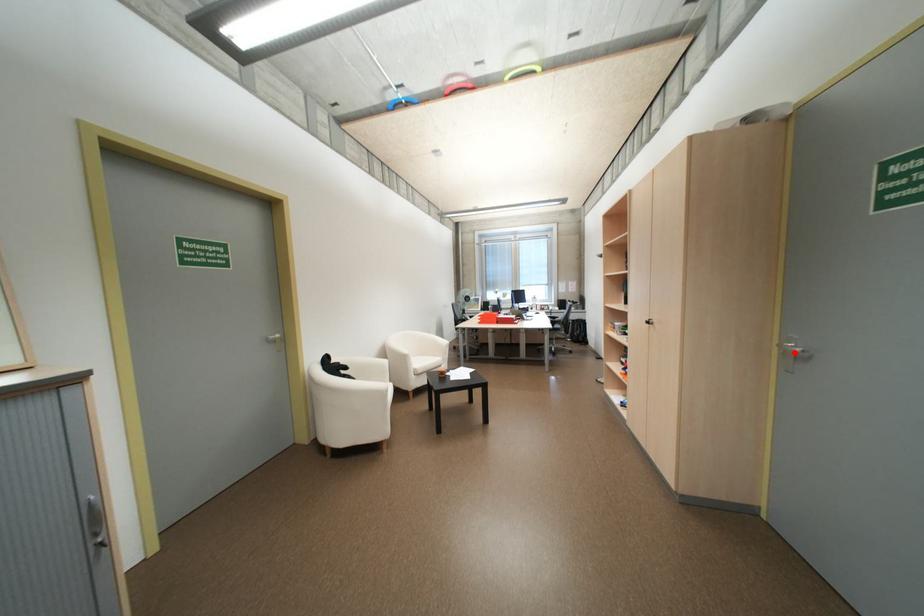
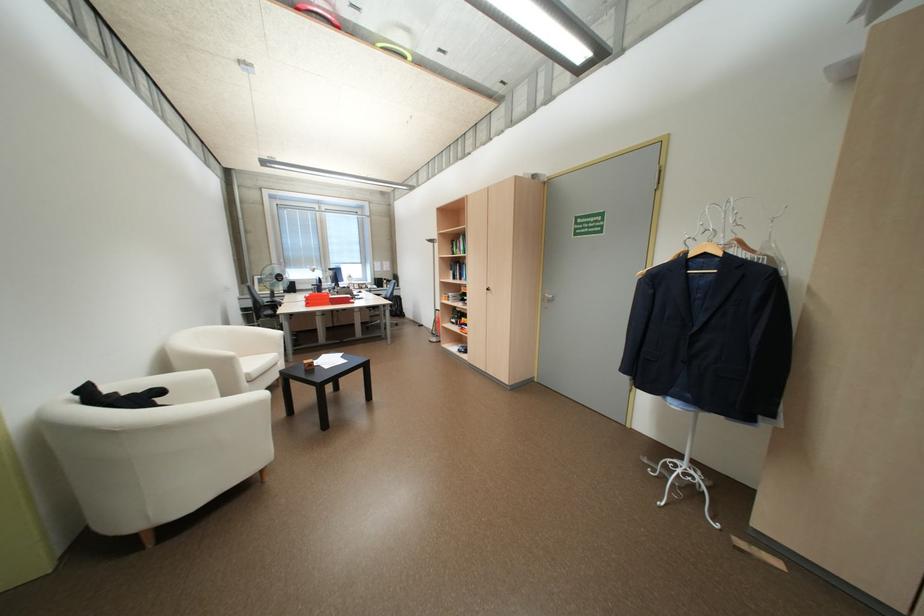
Where in the second image is the point corresponding to the highlighted location from the first image?

(553, 299)